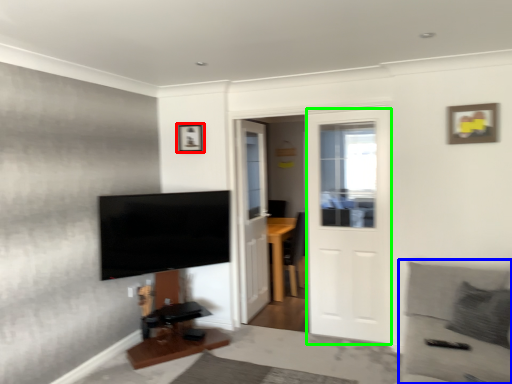
Question: Based on their relative distances, which object is farther from picture frame (highlighted by a red box)? Choose from couch (highlighted by a blue box) and door (highlighted by a green box).

Choices:
 (A) couch
 (B) door

Answer: (A)